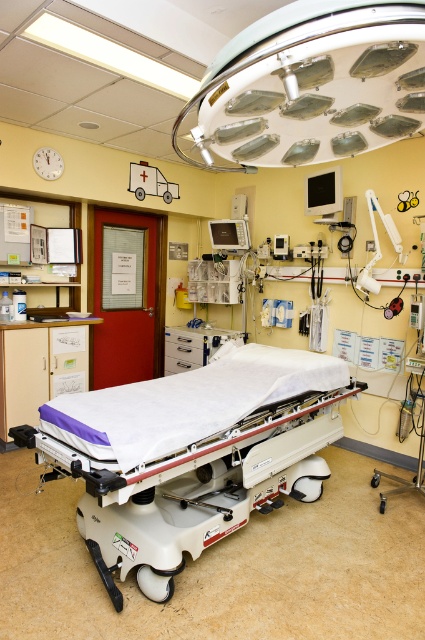
Is white matte bed at center below matte white ambulance at upper left?

Indeed, white matte bed at center is positioned under matte white ambulance at upper left.

Can you confirm if white matte bed at center is smaller than matte white ambulance at upper left?

Incorrect, white matte bed at center is not smaller in size than matte white ambulance at upper left.

Is point (136, 424) closer to camera compared to point (144, 193)?

Yes, point (136, 424) is closer to viewer.

Locate an element on the screen. Image resolution: width=425 pixels, height=640 pixels. white matte bed at center is located at coordinates (192, 460).

Is matte white surgical light at upper center smaller than white plastic medical arm at center-right?

No.

Does matte white surgical light at upper center have a larger size compared to white plastic medical arm at center-right?

Yes.

The image size is (425, 640). Identify the location of matte white surgical light at upper center. (309, 84).

Does matte white surgical light at upper center appear over matte white ambulance at upper left?

No.

Who is positioned more to the right, matte white surgical light at upper center or matte white ambulance at upper left?

From the viewer's perspective, matte white surgical light at upper center appears more on the right side.

Who is more distant from viewer, (340, 10) or (172, 189)?

Point (172, 189)

This screenshot has height=640, width=425. Find the location of `matte white surgical light at upper center`. matte white surgical light at upper center is located at coordinates (309, 84).